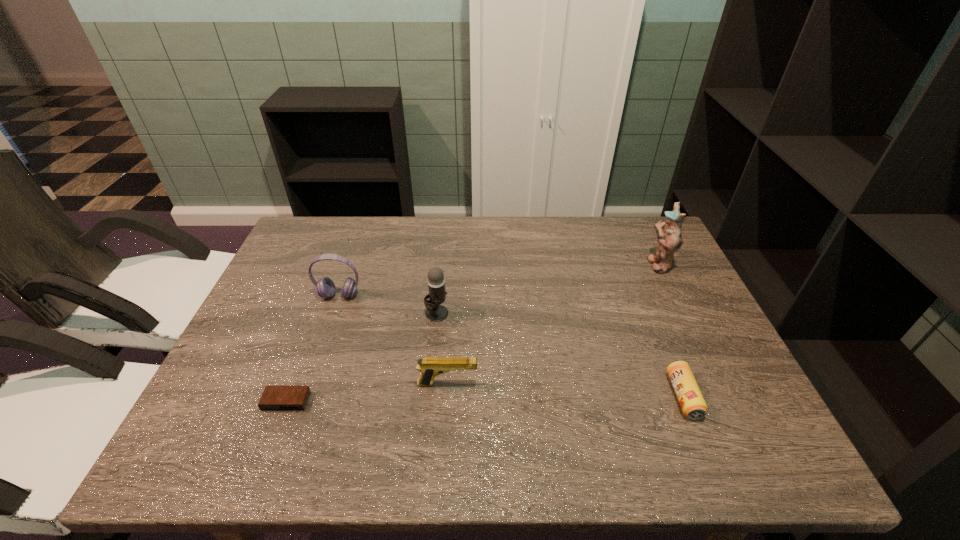
Where is `the tallest object`? Image resolution: width=960 pixels, height=540 pixels. the tallest object is located at coordinates (668, 232).

The height and width of the screenshot is (540, 960). Identify the location of figurine. (668, 232).

The image size is (960, 540). I want to click on the third farthest object, so click(435, 312).

Locate an element on the screen. This screenshot has height=540, width=960. headset is located at coordinates pos(325,287).

Where is `pistol`? The image size is (960, 540). pistol is located at coordinates (429, 367).

At what (x,y) coordinates should I click in order to perform the action: click on the fifth object from left to right. Please return your answer as a coordinate pair (x, y). The width and height of the screenshot is (960, 540). Looking at the image, I should click on (x=693, y=405).

Identify the location of beer can. (693, 405).

The image size is (960, 540). Identify the location of alarm clock. (274, 398).

Identify the location of vacant space located 0.090m on the front-facing side of the farthest object. (617, 264).

At what (x,y) coordinates should I click in order to perform the action: click on free space located on the front-facing side of the farthest object. Please return your answer as a coordinate pair (x, y). This screenshot has height=540, width=960. Looking at the image, I should click on (519, 264).